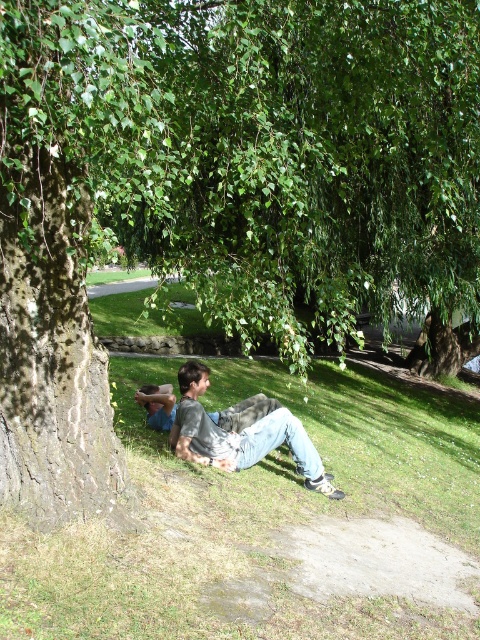
You are a photographer trying to capture a photo of the gray cotton shirt at center and the green grass at lower center. To ensure both are visible in the frame, should you adjust your camera to focus more to the left or the right?

The green grass at lower center is positioned on the right side of gray cotton shirt at center, so to include both in the frame, you should adjust your camera to focus more to the right.

You are standing in the scene and want to place a small picnic basket between the green grass at lower center and the gray cotton shirt at center. Based on their positions, where should you place the basket so it is between both objects?

The green grass at lower center is in front of the gray cotton shirt at center, so placing the picnic basket in front of the gray cotton shirt at center and behind the green grass at lower center would position it between both objects.